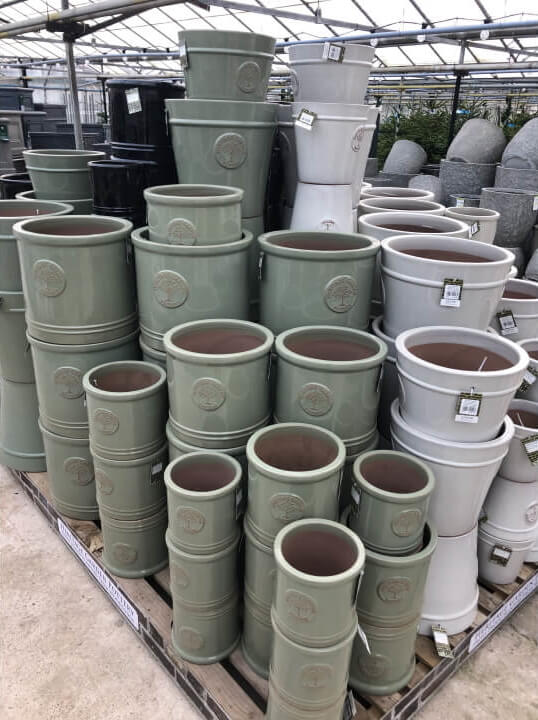
The image size is (538, 720). What are the coordinates of `medium green pot` in the screenshot? It's located at (247, 394).